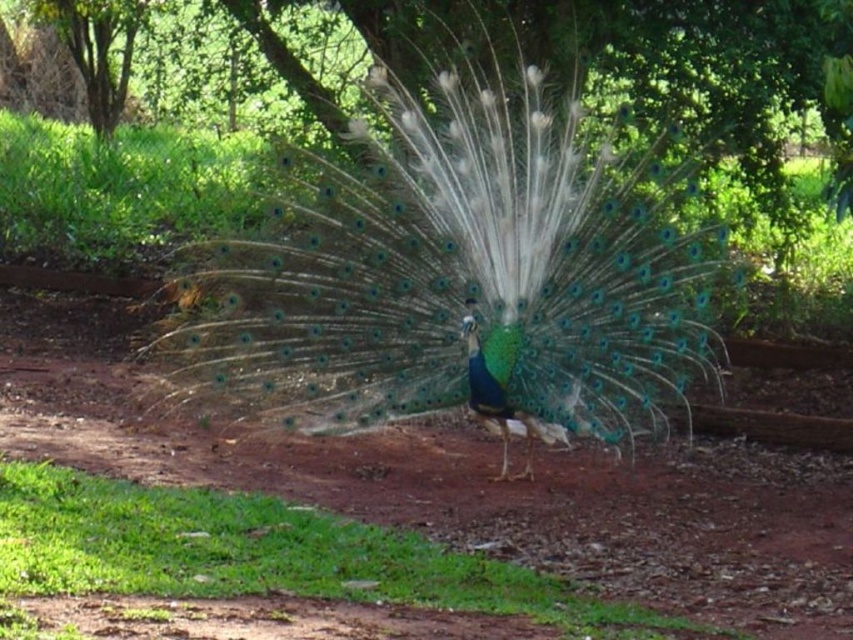
You are a photographer trying to capture the peacock in the image. You want to position yourself so that the shiny iridescent peacock at center is framed against the green grass at lower left. Is the peacock positioned in a way that allows this framing?

The shiny iridescent peacock at center is located above the green grass at lower left, so positioning yourself to frame the peacock against the grass is possible as the peacock is above the grass area.

You are standing at a point 24.76 feet away from the camera. You want to take a photo of the peacock in the scene. Can you reach the peacock from your current position at point (643, 180) to get a clear shot without moving?

The distance between point (643, 180) and the camera is 24.76 feet. Since you are at point (643, 180), you are already 24.76 feet away from the camera. To take a clear photo of the peacock, you need to be close enough. However, the given information does not specify the required distance for a clear shot. Without knowing the minimum distance needed, it is impossible to determine if you can get a clear shot without moving.